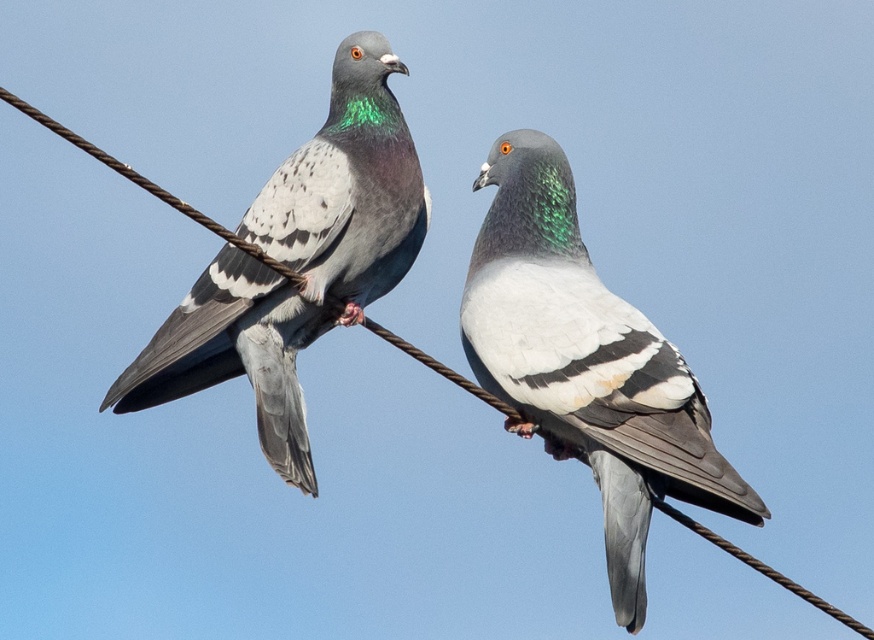
Looking at this image, you are a birdwatcher observing two pigeons on a wire. You notice the matte gray pigeon at center and the matte gray pigeon at left. Which pigeon is closer to the ground based on their positions?

The matte gray pigeon at center is positioned under the matte gray pigeon at left, so it is closer to the ground.

You are a birdwatcher observing two points on a wire where pigeons are perched. The points are labeled as point (567, 196) and point (295, 342). Based on their positions, which point is closer to you?

Point (567, 196) is closer to the viewer than point (295, 342).

You are a photographer standing at the camera position. You want to take a closeup photo of the matte gray pigeon at center. The camera lens has a minimum focusing distance of 1.5 meters. Can you take the photo without moving closer?

The matte gray pigeon at center is 7.51 meters away from camera. Since the minimum focusing distance is 1.5 meters, the camera can focus on the matte gray pigeon at center at 7.51 meters, so yes, you can take the photo without moving closer.